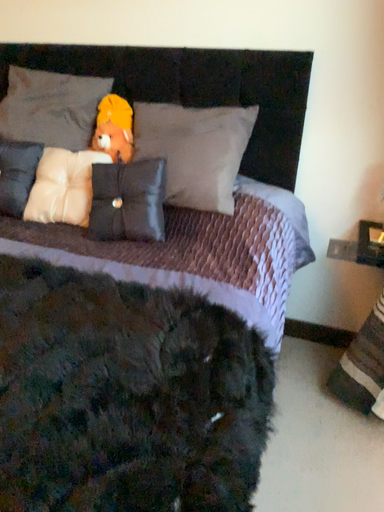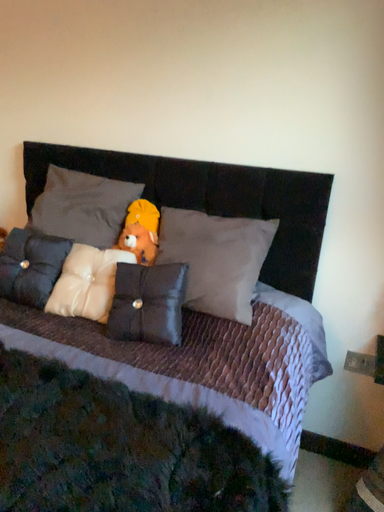
Question: Which way did the camera rotate in the video?

Choices:
 (A) rotated upward
 (B) rotated downward

Answer: (A)